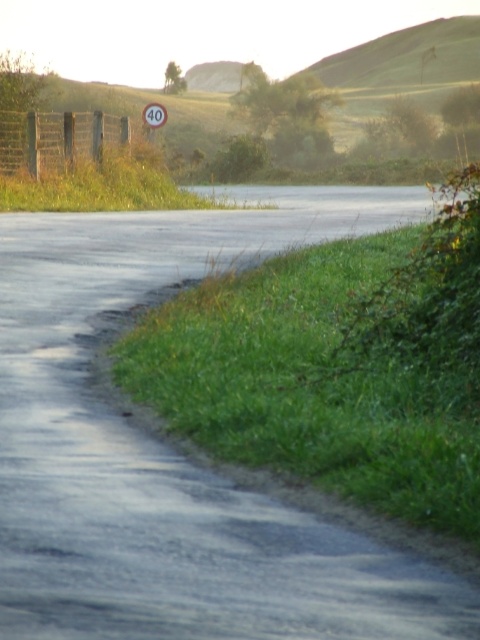
You are standing at the starting point of the road and want to walk to the end. Which point, point (x=286, y=604) or point (x=452, y=67), will you encounter first along your path?

You will encounter point (x=286, y=604) first because it is in front of point (x=452, y=67) along the road path.

You are a driver approaching the road and see the green grassy hill at upper center and the white plastic sign at upper center. Which object appears wider from your perspective?

The green grassy hill at upper center appears wider than the white plastic sign at upper center because its width is larger than the sign.

You are standing at the edge of the road and want to walk to both the point at (54, 406) and the point at (152, 122). Which point will you reach first?

You will reach the point at (54, 406) first because it is closer to you than the point at (152, 122).